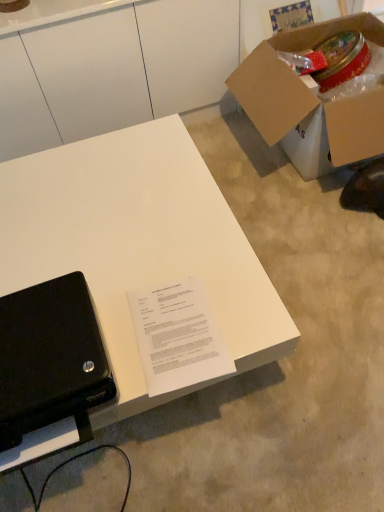
Where is `vacant space underneath white paper at center (from a real-world perspective)`? The width and height of the screenshot is (384, 512). vacant space underneath white paper at center (from a real-world perspective) is located at coordinates (178, 331).